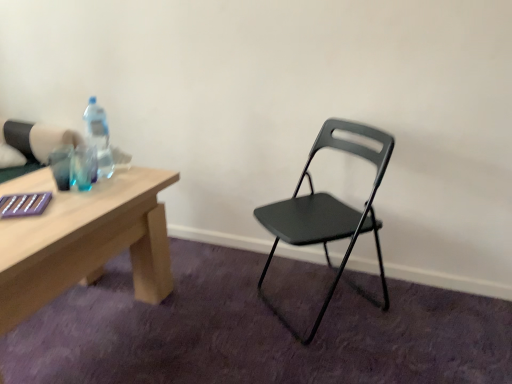
The height and width of the screenshot is (384, 512). In order to click on free point below matte black folding chair at center (from a real-world perspective) in this screenshot , I will do `click(308, 303)`.